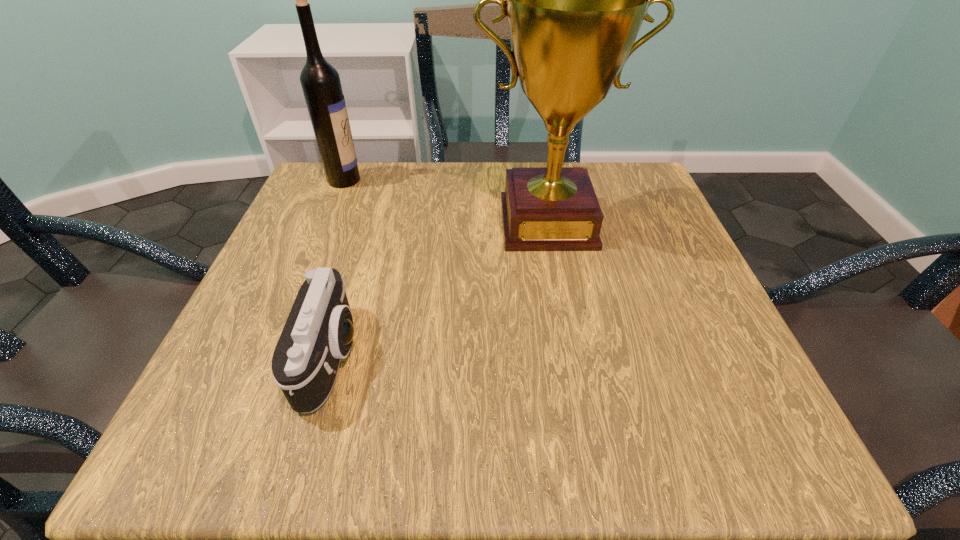
In the image, there is a desktop. Where is `vacant region at the left edge`? vacant region at the left edge is located at coordinates (243, 378).

Image resolution: width=960 pixels, height=540 pixels. What are the coordinates of `vacant space at the right edge of the desktop` in the screenshot? It's located at (660, 258).

In the image, there is a desktop. Find the location of `vacant space at the far left corner`. vacant space at the far left corner is located at coordinates (367, 173).

Where is `free space at the far right corner of the desktop`? free space at the far right corner of the desktop is located at coordinates [x=599, y=179].

Find the location of `vacant space at the near right corner of the desktop`. vacant space at the near right corner of the desktop is located at coordinates (677, 435).

At what (x,y) coordinates should I click in order to perform the action: click on free spot between the shortest object and the leftmost object. Please return your answer as a coordinate pair (x, y). Looking at the image, I should click on (338, 268).

In order to click on vacant point located between the second nearest object and the wine bottle in this screenshot , I will do `click(445, 201)`.

Locate an element on the screen. Image resolution: width=960 pixels, height=540 pixels. vacant area that lies between the award and the farthest object is located at coordinates (445, 201).

I want to click on free space between the nearest object and the leftmost object, so click(x=338, y=268).

You are a GUI agent. You are given a task and a screenshot of the screen. Output one action in this format:
    pyautogui.click(x=<x>, y=<y>)
    Task: Click on the free spot between the wine bottle and the nearest object
    
    Given the screenshot: What is the action you would take?
    pyautogui.click(x=338, y=268)